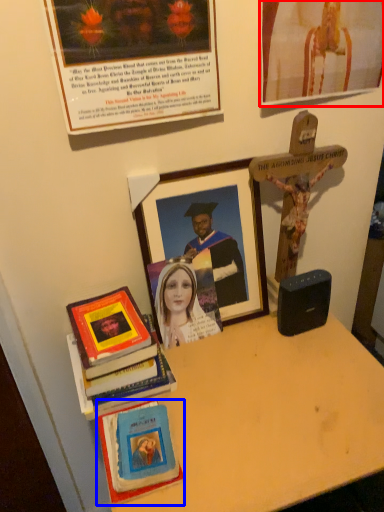
Question: Which point is closer to the camera, picture frame (highlighted by a red box) or book (highlighted by a blue box)?

Choices:
 (A) picture frame
 (B) book

Answer: (A)